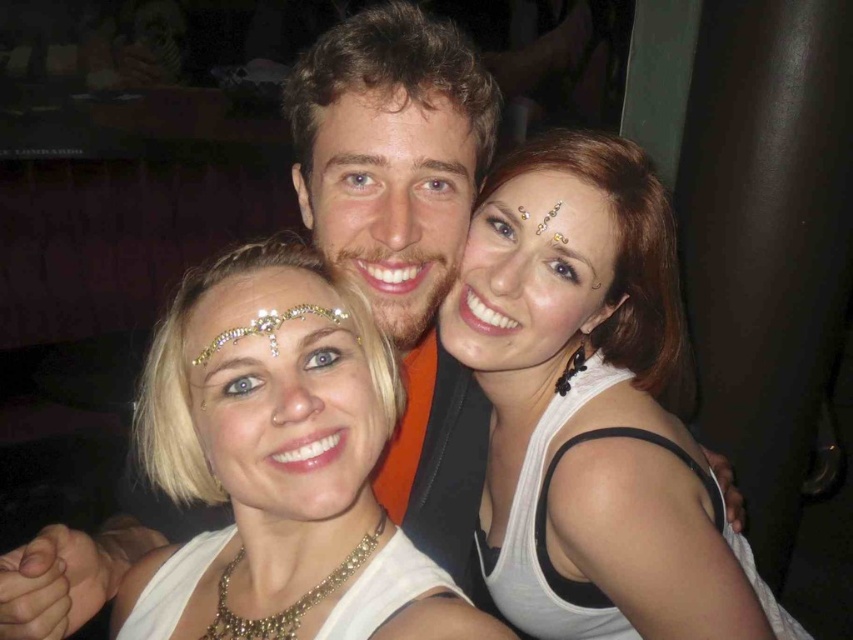
Question: Estimate the real-world distances between objects in this image. Which object is farther from the white matte tank top at center?

Choices:
 (A) white matte necklace at center
 (B) white matte headband at center
 (C) matte gold headband at center

Answer: (B)

Question: Estimate the real-world distances between objects in this image. Which object is farther from the matte gold headband at center?

Choices:
 (A) white matte tank top at center
 (B) white matte headband at center
 (C) white matte necklace at center

Answer: (B)

Question: Among these objects, which one is farthest from the camera?

Choices:
 (A) white matte necklace at center
 (B) white matte tank top at center

Answer: (B)

Question: Is white matte necklace at center smaller than white matte headband at center?

Choices:
 (A) yes
 (B) no

Answer: (B)

Question: Does white matte tank top at center appear on the right side of white matte headband at center?

Choices:
 (A) no
 (B) yes

Answer: (B)

Question: Is matte skin face at center below matte gold headband at center?

Choices:
 (A) no
 (B) yes

Answer: (A)